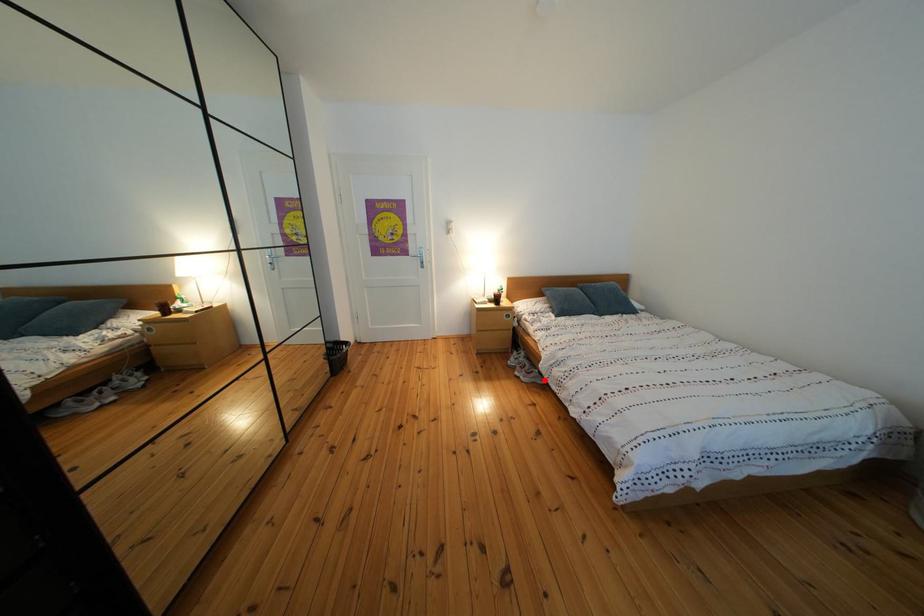
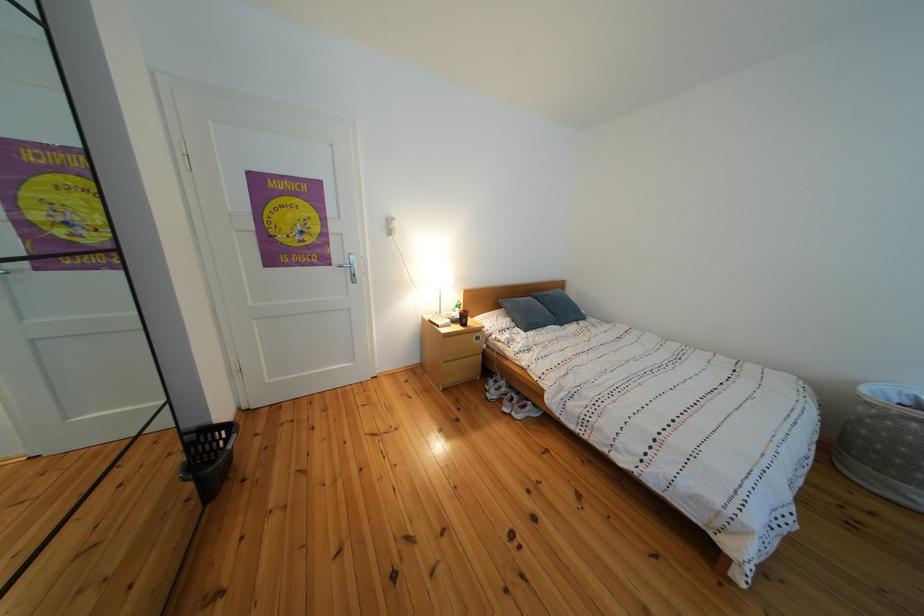
Question: I am providing you with two images of the same scene from different viewpoints. In image1, a red point is highlighted. Considering the same 3D point in image2, which of the following is correct?

Choices:
 (A) It is closer
 (B) It is farther

Answer: (B)